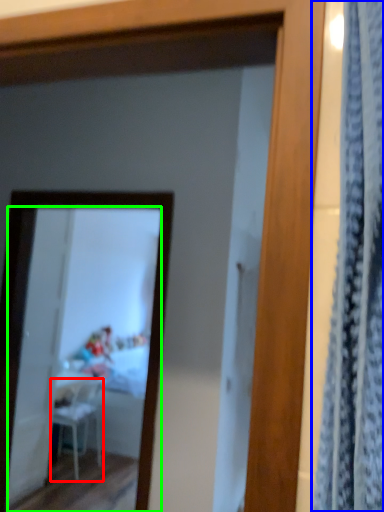
Question: Which is nearer to the chair (highlighted by a red box)? curtain (highlighted by a blue box) or mirror (highlighted by a green box).

Choices:
 (A) curtain
 (B) mirror

Answer: (B)